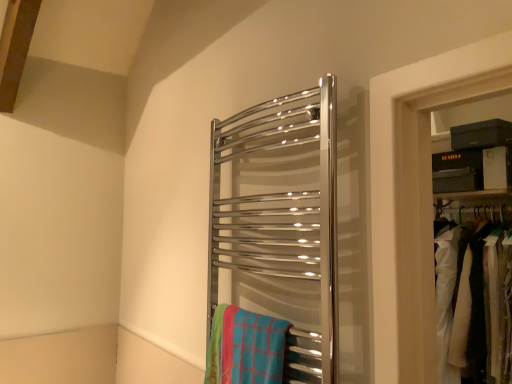
Locate an element on the screen. white fabric at right is located at coordinates (471, 301).

Is white fabric at right facing away from blue plaid beach towel at center?

white fabric at right does not have its back to blue plaid beach towel at center.

Is the depth of white fabric at right less than that of blue plaid beach towel at center?

That is False.

From a real-world perspective, which is physically below, white fabric at right or blue plaid beach towel at center?

In real-world perspective, blue plaid beach towel at center is lower.

Between blue plaid beach towel at center and polished chrome towel rack at center, which one has larger width?

polished chrome towel rack at center.

Does blue plaid beach towel at center appear on the right side of polished chrome towel rack at center?

No, blue plaid beach towel at center is not to the right of polished chrome towel rack at center.

From a real-world perspective, is blue plaid beach towel at center physically below polished chrome towel rack at center?

Yes, from a real-world perspective, blue plaid beach towel at center is below polished chrome towel rack at center.

Are white fabric at right and polished chrome towel rack at center making contact?

No, white fabric at right is not touching polished chrome towel rack at center.

From the image's perspective, which one is positioned lower, white fabric at right or polished chrome towel rack at center?

white fabric at right appears lower in the image.

From the picture: How many degrees apart are the facing directions of white fabric at right and polished chrome towel rack at center?

They differ by 0.066 degrees in their facing directions.

Between white fabric at right and polished chrome towel rack at center, which one has smaller width?

With smaller width is polished chrome towel rack at center.

Is blue plaid beach towel at center to the right of white fabric at right from the viewer's perspective?

No, blue plaid beach towel at center is not to the right of white fabric at right.

Considering the sizes of objects blue plaid beach towel at center and white fabric at right in the image provided, who is taller, blue plaid beach towel at center or white fabric at right?

white fabric at right is taller.

Considering the sizes of objects blue plaid beach towel at center and white fabric at right in the image provided, who is wider, blue plaid beach towel at center or white fabric at right?

white fabric at right is wider.

What's the angular difference between polished chrome towel rack at center and blue plaid beach towel at center's facing directions?

The angular difference between polished chrome towel rack at center and blue plaid beach towel at center is 0.00483 degrees.

Is polished chrome towel rack at center in front of or behind blue plaid beach towel at center in the image?

Visually, polished chrome towel rack at center is located in front of blue plaid beach towel at center.

Looking at this image, is polished chrome towel rack at center aimed at blue plaid beach towel at center?

Yes, polished chrome towel rack at center faces towards blue plaid beach towel at center.

Does polished chrome towel rack at center appear on the left side of blue plaid beach towel at center?

No, polished chrome towel rack at center is not to the left of blue plaid beach towel at center.

Is polished chrome towel rack at center directly adjacent to white fabric at right?

There is a gap between polished chrome towel rack at center and white fabric at right.

The height and width of the screenshot is (384, 512). I want to click on laundry below the polished chrome towel rack at center (from a real-world perspective), so click(x=471, y=301).

From a real-world perspective, is polished chrome towel rack at center below white fabric at right?

No.

Considering the sizes of polished chrome towel rack at center and white fabric at right in the image, is polished chrome towel rack at center wider or thinner than white fabric at right?

In the image, polished chrome towel rack at center appears to be more narrow than white fabric at right.

Image resolution: width=512 pixels, height=384 pixels. I want to click on beach towel below the white fabric at right (from a real-world perspective), so click(x=246, y=347).

Locate an element on the screen. beach towel on the left of polished chrome towel rack at center is located at coordinates (246, 347).

Which object lies further to the anchor point white fabric at right, blue plaid beach towel at center or polished chrome towel rack at center?

Among the two, blue plaid beach towel at center is located further to white fabric at right.

Based on their spatial positions, is white fabric at right or polished chrome towel rack at center further from blue plaid beach towel at center?

white fabric at right.

From the image, which object appears to be farther from blue plaid beach towel at center, polished chrome towel rack at center or white fabric at right?

The object further to blue plaid beach towel at center is white fabric at right.

Based on their spatial positions, is white fabric at right or blue plaid beach towel at center closer to polished chrome towel rack at center?

blue plaid beach towel at center is closer to polished chrome towel rack at center.

Estimate the real-world distances between objects in this image. Which object is further from polished chrome towel rack at center, blue plaid beach towel at center or white fabric at right?

white fabric at right.

Estimate the real-world distances between objects in this image. Which object is closer to white fabric at right, polished chrome towel rack at center or blue plaid beach towel at center?

Among the two, polished chrome towel rack at center is located nearer to white fabric at right.

The width and height of the screenshot is (512, 384). What are the coordinates of `towel rack between blue plaid beach towel at center and white fabric at right from left to right` in the screenshot? It's located at (282, 227).